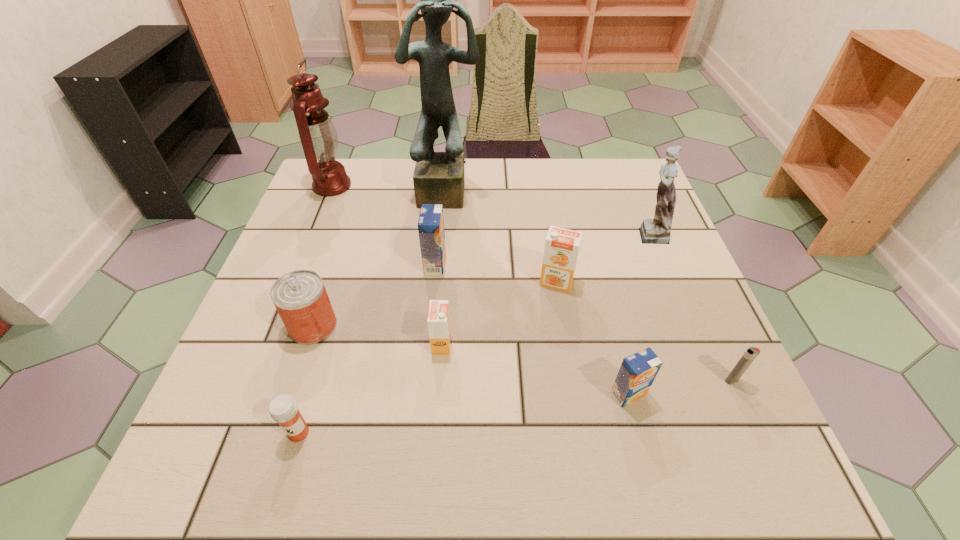
Where is `free space located on the front-facing side of the third farthest object`? free space located on the front-facing side of the third farthest object is located at coordinates (553, 233).

Locate an element on the screen. free region located 0.290m on the front-facing side of the third farthest object is located at coordinates (513, 233).

You are a GUI agent. You are given a task and a screenshot of the screen. Output one action in this format:
    pyautogui.click(x=<x>, y=<y>)
    Task: Click on the free location located on the front of the farther blue orange_juice
    The image size is (960, 540).
    Given the screenshot: What is the action you would take?
    pyautogui.click(x=431, y=301)

This screenshot has width=960, height=540. Find the location of `free space located on the left of the bigger orange orange juice`. free space located on the left of the bigger orange orange juice is located at coordinates (414, 282).

What are the coordinates of `free point located on the back of the can` in the screenshot? It's located at (341, 242).

Locate an element on the screen. free point located 0.340m on the back of the nearer orange orange juice is located at coordinates (450, 226).

Identify the location of vacant space located on the back of the nearer blue orange_juice. (597, 276).

Identify the location of vacant point located on the left of the igniter. (573, 380).

Locate an element on the screen. vacant space situated 0.050m on the label side of the medicine is located at coordinates (286, 476).

Find the location of a particular element. sculpture present at the far edge is located at coordinates (438, 178).